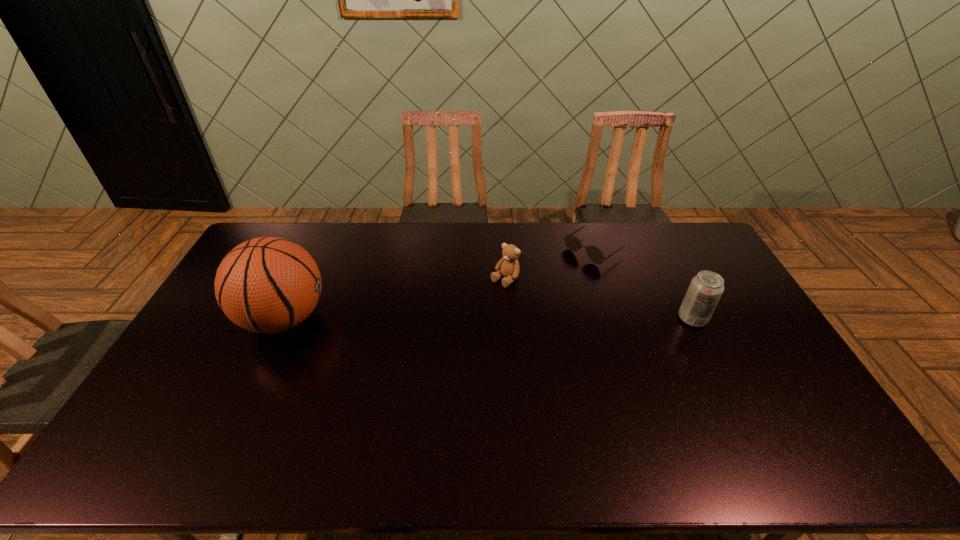
Find the location of a particular element. The image size is (960, 540). vacant space at the left edge of the desktop is located at coordinates (212, 332).

The image size is (960, 540). I want to click on free region at the far right corner, so click(678, 248).

You are a GUI agent. You are given a task and a screenshot of the screen. Output one action in this format:
    pyautogui.click(x=<x>, y=<y>)
    Task: Click on the vacant space that is in between the second object from right to left and the third shortest object
    The image size is (960, 540).
    Given the screenshot: What is the action you would take?
    pyautogui.click(x=643, y=284)

Find the location of a particular element. empty space that is in between the third object from right to left and the soda can is located at coordinates (599, 299).

You are a GUI agent. You are given a task and a screenshot of the screen. Output one action in this format:
    pyautogui.click(x=<x>, y=<y>)
    Task: Click on the empty location between the basketball and the sunglasses
    Image resolution: width=960 pixels, height=540 pixels.
    Given the screenshot: What is the action you would take?
    pyautogui.click(x=439, y=284)

Image resolution: width=960 pixels, height=540 pixels. Find the location of `free spot between the second object from right to left and the tallest object`. free spot between the second object from right to left and the tallest object is located at coordinates (439, 284).

What are the coordinates of `free space that is in between the shortest object and the rightmost object` in the screenshot? It's located at (643, 284).

The height and width of the screenshot is (540, 960). Identify the location of vacant area that lies between the rightmost object and the third tallest object. (599, 299).

You are a GUI agent. You are given a task and a screenshot of the screen. Output one action in this format:
    pyautogui.click(x=<x>, y=<y>)
    Task: Click on the free space between the rightmost object and the basketball
    Image resolution: width=960 pixels, height=540 pixels.
    Given the screenshot: What is the action you would take?
    pyautogui.click(x=489, y=319)

Locate an element on the screen. This screenshot has height=540, width=960. unoccupied position between the third tallest object and the sunglasses is located at coordinates (549, 265).